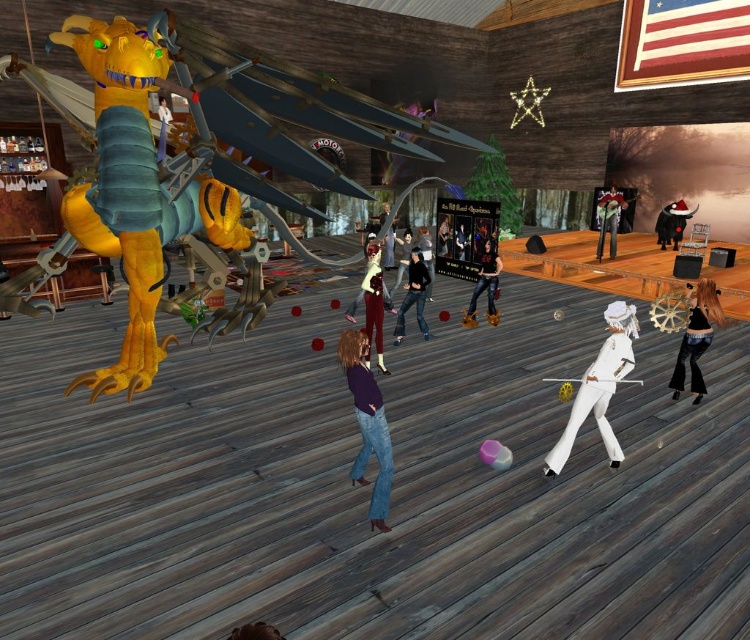
You are a photographer at the event and want to capture a photo of both the black santa hat at center and matte white dress at center. Since you want them to be side by side, which one should be on the left in the photo?

The matte white dress at center should be on the left in the photo because the black santa hat at center is to the right of it.

You are a costume designer preparing for a performance. You have two options for the lead singer of the band in the image. The purple matte shirt at center and the black leather jacket at center. Which clothing item is wider?

The purple matte shirt at center is wider than the black leather jacket at center.